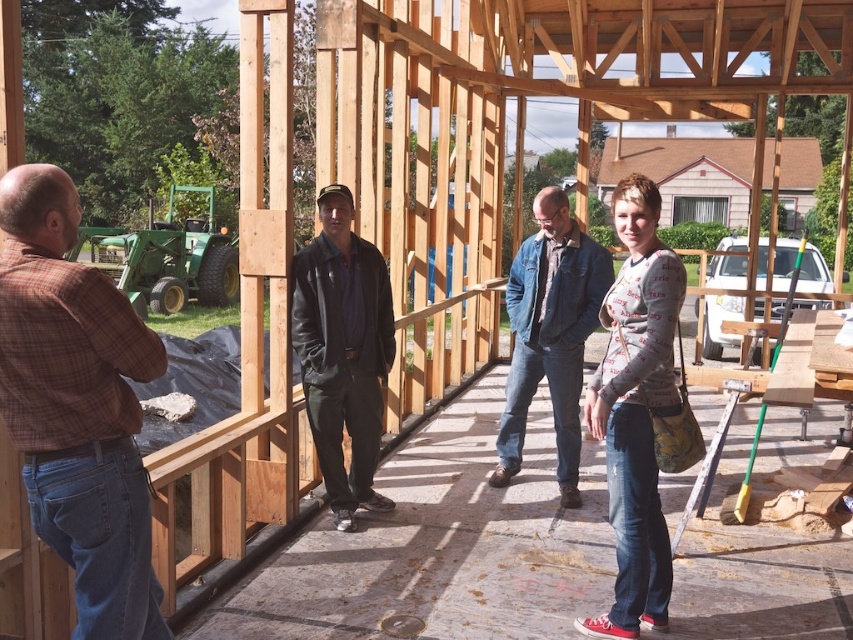
Question: Based on their relative distances, which object is nearer to the plaid shirt at left?

Choices:
 (A) printed cotton sweater at center
 (B) denim jacket at center
 (C) dark blue leather jacket at center

Answer: (C)

Question: Does printed cotton sweater at center appear under denim jacket at center?

Choices:
 (A) yes
 (B) no

Answer: (A)

Question: Based on their relative distances, which object is nearer to the plaid shirt at left?

Choices:
 (A) dark blue leather jacket at center
 (B) printed cotton sweater at center
 (C) denim jacket at center

Answer: (A)

Question: Is printed cotton sweater at center to the right of dark blue leather jacket at center from the viewer's perspective?

Choices:
 (A) no
 (B) yes

Answer: (B)

Question: Which point is farther to the camera?

Choices:
 (A) printed cotton sweater at center
 (B) dark blue leather jacket at center
 (C) plaid shirt at left
 (D) denim jacket at center

Answer: (B)

Question: Is plaid shirt at left closer to camera compared to printed cotton sweater at center?

Choices:
 (A) no
 (B) yes

Answer: (B)